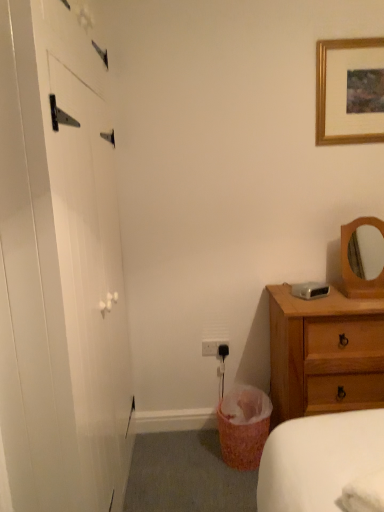
Question: From a real-world perspective, is wooden chest of drawers at right positioned above or below white matte barn door at left?

Choices:
 (A) above
 (B) below

Answer: (B)

Question: Choose the correct answer: Is wooden chest of drawers at right inside white matte barn door at left or outside it?

Choices:
 (A) outside
 (B) inside

Answer: (A)

Question: Estimate the real-world distances between objects in this image. Which object is farther from the gold wooden picture frame at upper right?

Choices:
 (A) white matte barn door at left
 (B) white plastic electric outlet at lower center
 (C) pink woven laundry basket at lower center
 (D) wooden chest of drawers at right

Answer: (C)

Question: Estimate the real-world distances between objects in this image. Which object is closer to the gold wooden picture frame at upper right?

Choices:
 (A) wooden chest of drawers at right
 (B) pink woven laundry basket at lower center
 (C) white plastic electric outlet at lower center
 (D) white matte barn door at left

Answer: (A)